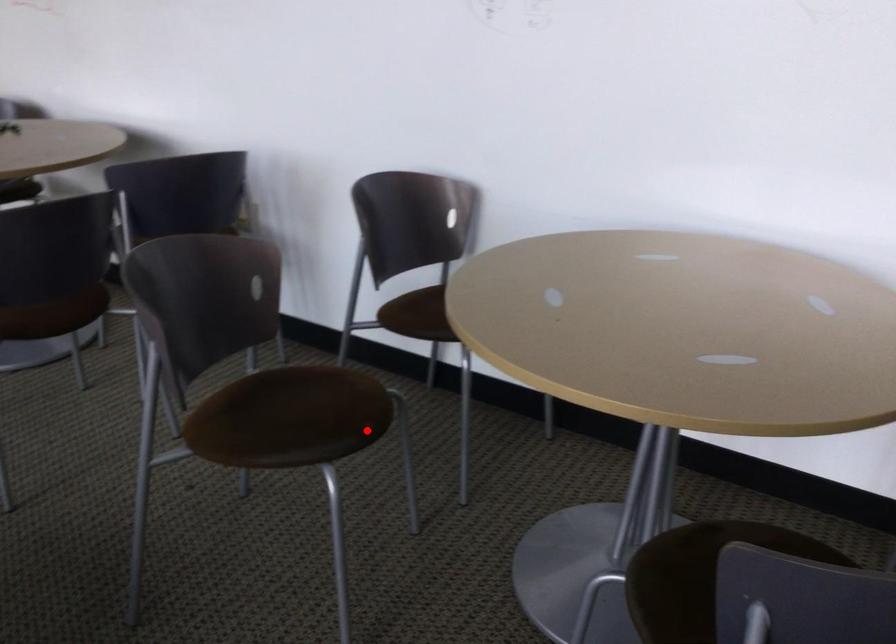
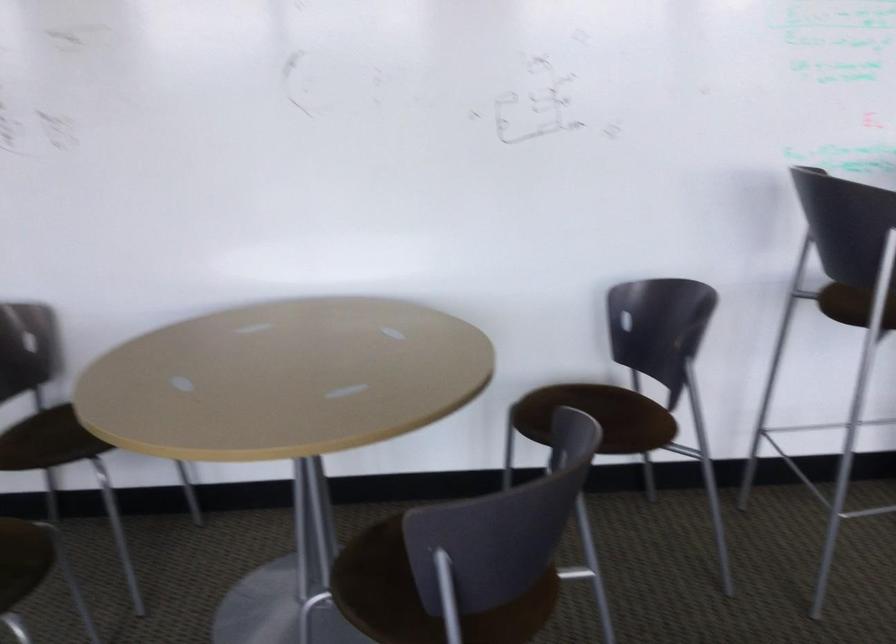
Locate, in the second image, the point that corresponds to the highlighted location in the first image.

(22, 560)